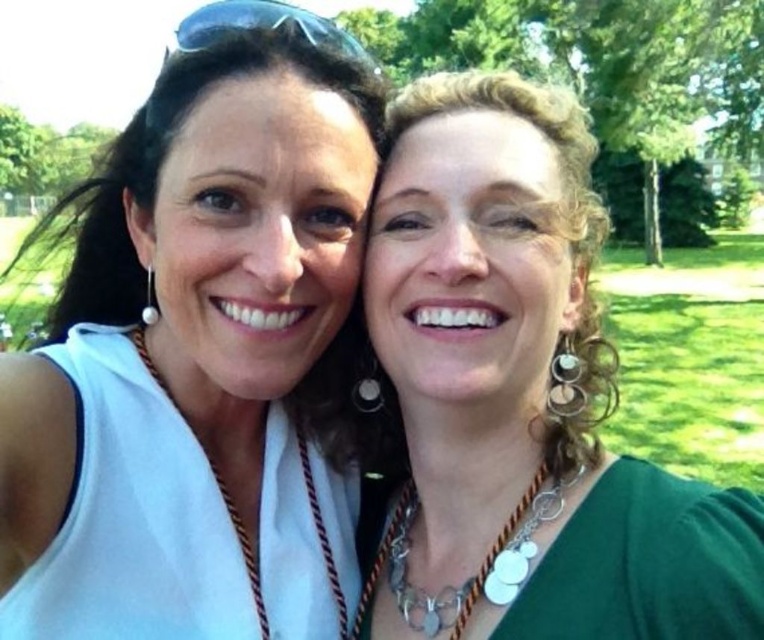
Question: Among these objects, which one is farthest from the camera?

Choices:
 (A) black plastic goggles at upper center
 (B) silver metallic chain at center
 (C) green matte necklace at center

Answer: (A)

Question: Is white fabric at left positioned in front of silver metallic chain at center?

Choices:
 (A) no
 (B) yes

Answer: (B)

Question: Is black plastic goggles at upper center behind silver metallic chain at center?

Choices:
 (A) yes
 (B) no

Answer: (A)

Question: Estimate the real-world distances between objects in this image. Which object is closer to the silver metallic chain at center?

Choices:
 (A) black plastic goggles at upper center
 (B) white fabric at left
 (C) green matte necklace at center

Answer: (C)

Question: Which object is farther from the camera taking this photo?

Choices:
 (A) black plastic goggles at upper center
 (B) white fabric at left

Answer: (A)

Question: Does white fabric at left appear on the left side of silver metallic chain at center?

Choices:
 (A) no
 (B) yes

Answer: (B)